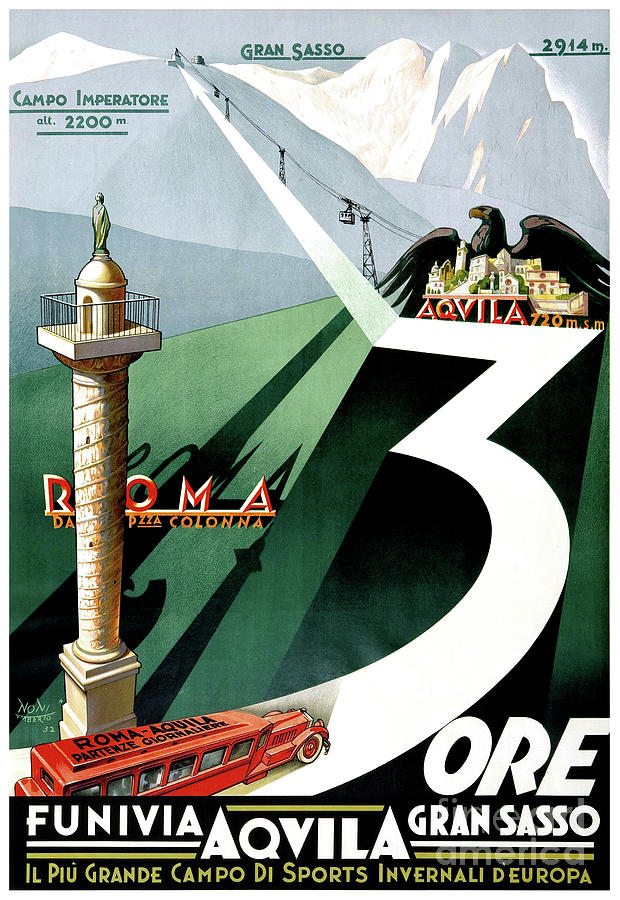
This screenshot has width=620, height=900. Find the location of `poster`. poster is located at coordinates (359, 546).